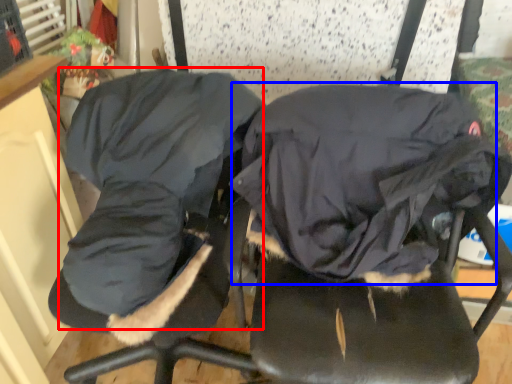
Question: Among these objects, which one is nearest to the camera, clothing (highlighted by a red box) or sleeping bag (highlighted by a blue box)?

Choices:
 (A) clothing
 (B) sleeping bag

Answer: (A)